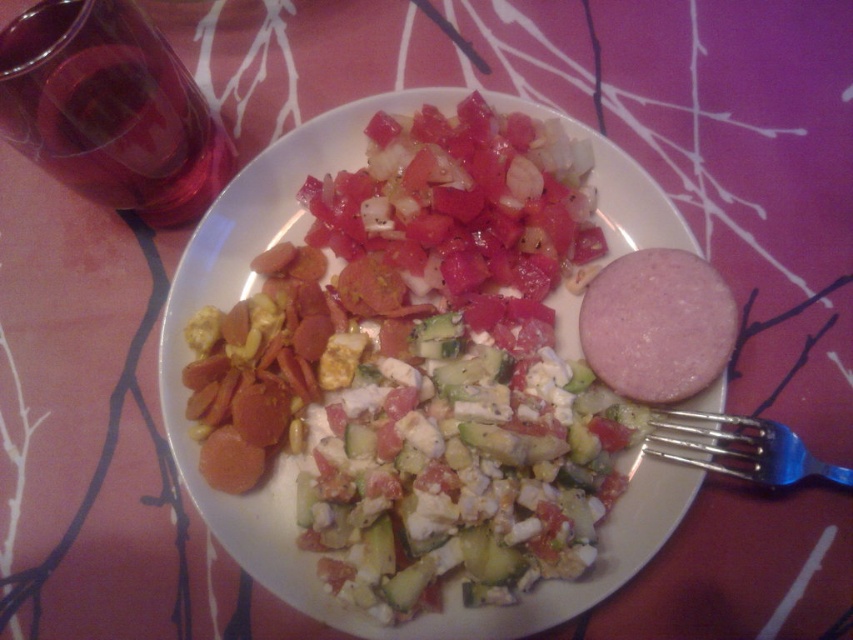
Is translucent glass at top left above blue metallic fork at lower right?

Indeed, translucent glass at top left is positioned over blue metallic fork at lower right.

Which is behind, point (32, 156) or point (689, 456)?

Point (689, 456)

The image size is (853, 640). I want to click on translucent glass at top left, so tap(109, 109).

Is white ceramic plate at center shorter than translucent glass at top left?

No.

Based on the photo, is white ceramic plate at center closer to the viewer compared to translucent glass at top left?

That is False.

Is point (637, 237) positioned behind point (149, 115)?

Yes, it is behind point (149, 115).

This screenshot has height=640, width=853. Find the location of `white ceramic plate at center`. white ceramic plate at center is located at coordinates (299, 456).

Is white ceramic plate at center behind pink smooth ham at center?

No, white ceramic plate at center is closer to the viewer.

Can you confirm if white ceramic plate at center is bigger than pink smooth ham at center?

Yes, white ceramic plate at center is bigger than pink smooth ham at center.

The width and height of the screenshot is (853, 640). What do you see at coordinates (299, 456) in the screenshot?
I see `white ceramic plate at center` at bounding box center [299, 456].

Identify the location of white ceramic plate at center. This screenshot has height=640, width=853. pyautogui.click(x=299, y=456).